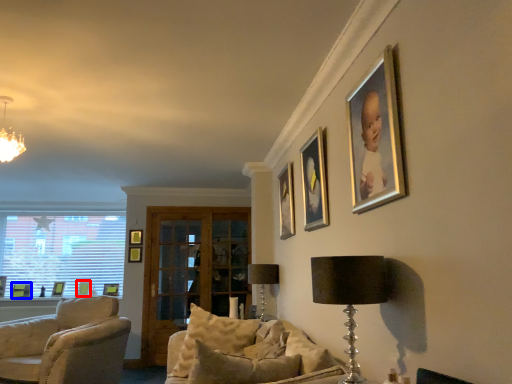
Question: Which object is closer to the camera taking this photo, picture frame (highlighted by a red box) or picture frame (highlighted by a blue box)?

Choices:
 (A) picture frame
 (B) picture frame

Answer: (B)